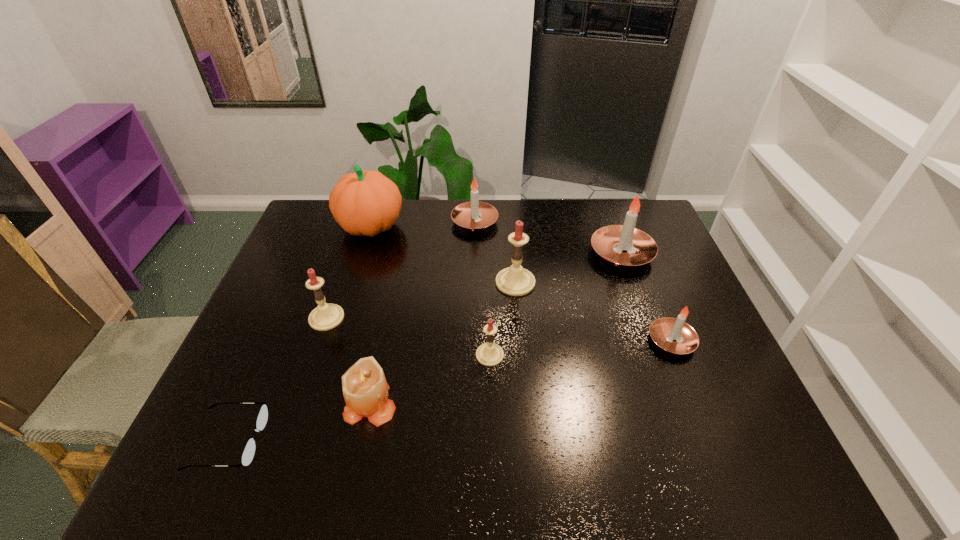
The image size is (960, 540). I want to click on vacant space at the near edge of the desktop, so click(x=336, y=476).

In the image, there is a desktop. Identify the location of vacant region at the left edge. (291, 260).

This screenshot has height=540, width=960. I want to click on free space at the right edge of the desktop, so pos(659,296).

This screenshot has width=960, height=540. What are the coordinates of `free space at the far right corner of the desktop` in the screenshot? It's located at (644, 218).

Image resolution: width=960 pixels, height=540 pixels. I want to click on vacant space that is in between the orange pumpkin and the beige candle, so click(x=371, y=315).

At what (x,y) coordinates should I click in order to perform the action: click on empty location between the biggest white candle and the farthest red candle. Please return your answer as a coordinate pair (x, y). Looking at the image, I should click on (568, 268).

The width and height of the screenshot is (960, 540). What are the coordinates of `blank region between the second smallest red candle and the spectacles` in the screenshot? It's located at (277, 379).

The width and height of the screenshot is (960, 540). What are the coordinates of `vacant point located between the second candle from left to right and the nearest red candle` in the screenshot? It's located at (430, 379).

The image size is (960, 540). I want to click on empty space between the orange pumpkin and the second biggest white candle, so click(x=422, y=224).

Image resolution: width=960 pixels, height=540 pixels. What are the coordinates of `empty space that is in between the nearest candle and the nearest white candle` in the screenshot? It's located at (520, 372).